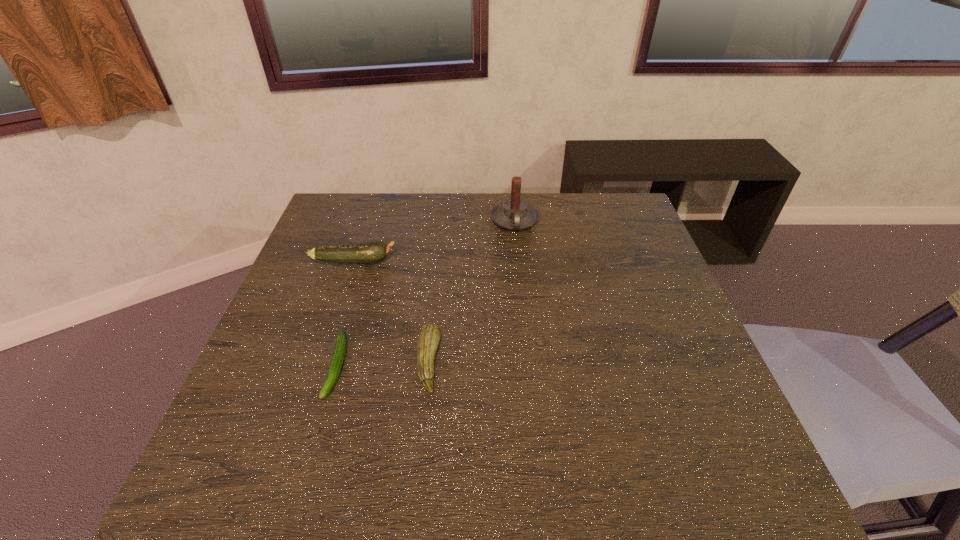
Where is `free space that satisfies the following two spatial constraints: 1. at the stem end of the third tallest object; 2. on the front-facing side of the shortest zucchini`? free space that satisfies the following two spatial constraints: 1. at the stem end of the third tallest object; 2. on the front-facing side of the shortest zucchini is located at coordinates (428, 366).

Locate an element on the screen. vacant region that satisfies the following two spatial constraints: 1. on the side of the farthest object with the handle loop; 2. at the blossom end of the tallest zucchini is located at coordinates (518, 261).

Locate an element on the screen. The height and width of the screenshot is (540, 960). vacant space that satisfies the following two spatial constraints: 1. on the side of the rightmost object with the handle loop; 2. at the stem end of the rightmost zucchini is located at coordinates (529, 362).